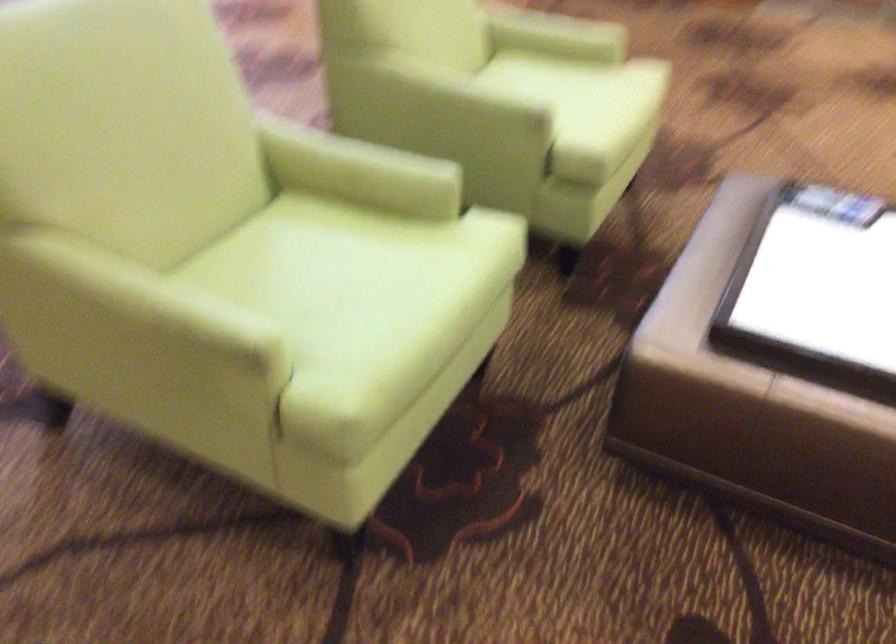
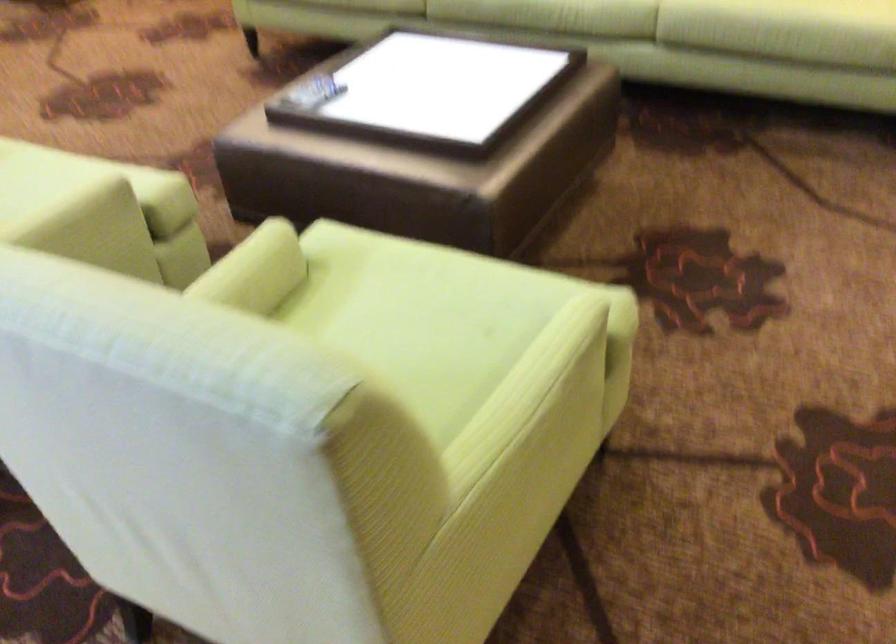
Find the pixel in the second image that matches point 142,292 in the first image.

(528, 393)